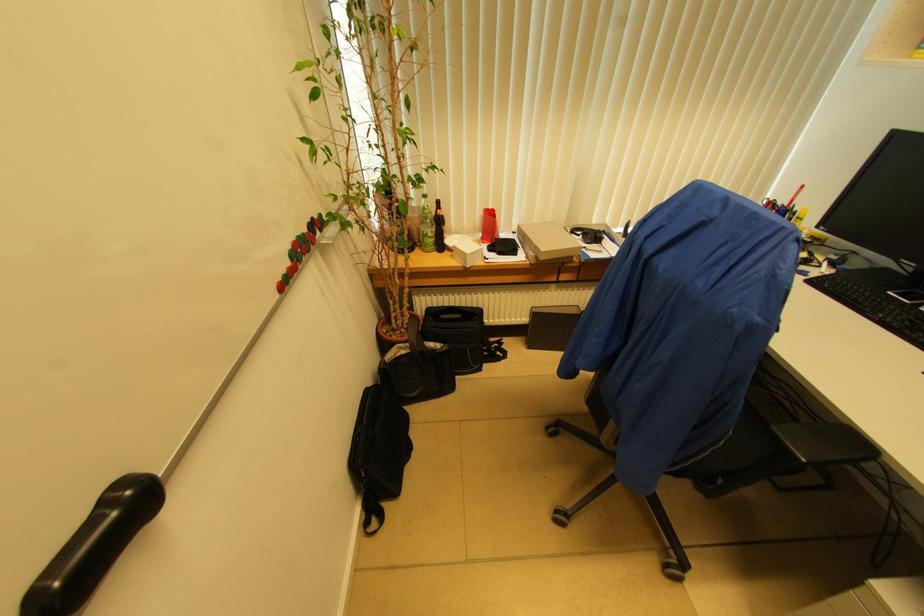
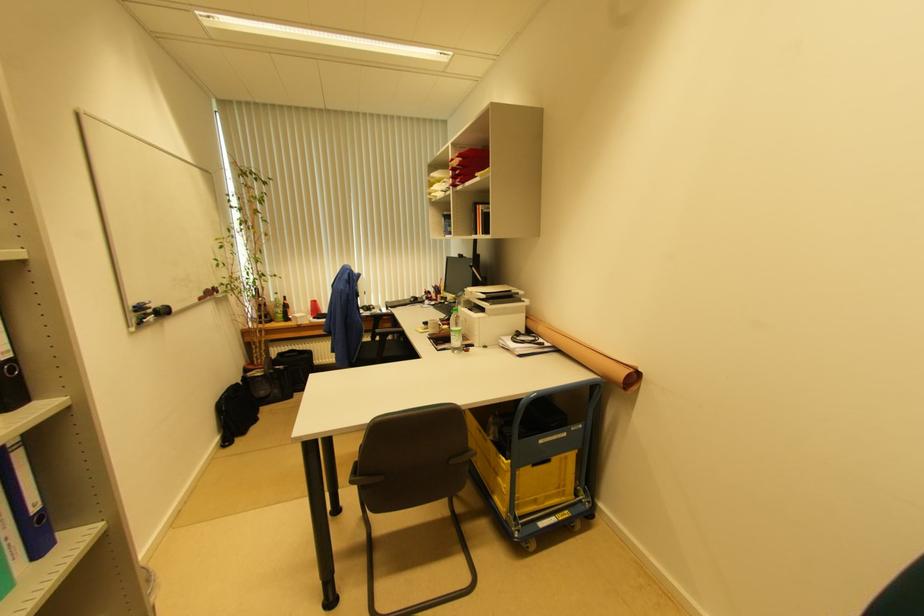
Question: I am providing you with two images of the same scene from different viewpoints. In image1, a red point is highlighted. Considering the same 3D point in image2, which of the following is correct?

Choices:
 (A) It is closer
 (B) It is farther

Answer: (B)